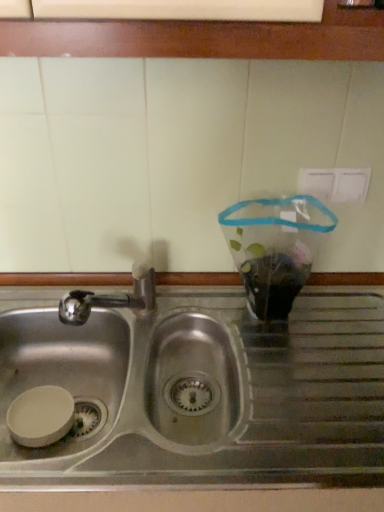
Question: Is stainless steel sink at center positioned before metallic sink at lower center?

Choices:
 (A) no
 (B) yes

Answer: (B)

Question: Would you say stainless steel sink at center contains metallic sink at lower center?

Choices:
 (A) no
 (B) yes

Answer: (A)

Question: Does stainless steel sink at center have a lesser width compared to metallic sink at lower center?

Choices:
 (A) no
 (B) yes

Answer: (A)

Question: Is stainless steel sink at center next to metallic sink at lower center and touching it?

Choices:
 (A) yes
 (B) no

Answer: (B)

Question: Does stainless steel sink at center have a greater width compared to metallic sink at lower center?

Choices:
 (A) no
 (B) yes

Answer: (B)

Question: Does stainless steel sink at center have a larger size compared to metallic sink at lower center?

Choices:
 (A) yes
 (B) no

Answer: (A)

Question: Could you tell me if metallic sink at lower center is facing stainless steel sink at center?

Choices:
 (A) no
 (B) yes

Answer: (B)

Question: Is metallic sink at lower center at the right side of stainless steel sink at center?

Choices:
 (A) no
 (B) yes

Answer: (A)

Question: Is metallic sink at lower center bigger than stainless steel sink at center?

Choices:
 (A) no
 (B) yes

Answer: (A)

Question: Is metallic sink at lower center next to stainless steel sink at center?

Choices:
 (A) no
 (B) yes

Answer: (A)

Question: From the image's perspective, is metallic sink at lower center beneath stainless steel sink at center?

Choices:
 (A) yes
 (B) no

Answer: (B)

Question: Is metallic sink at lower center positioned in front of stainless steel sink at center?

Choices:
 (A) yes
 (B) no

Answer: (B)

Question: Considering their positions, is metallic sink at lower center located in front of or behind stainless steel sink at center?

Choices:
 (A) front
 (B) behind

Answer: (B)